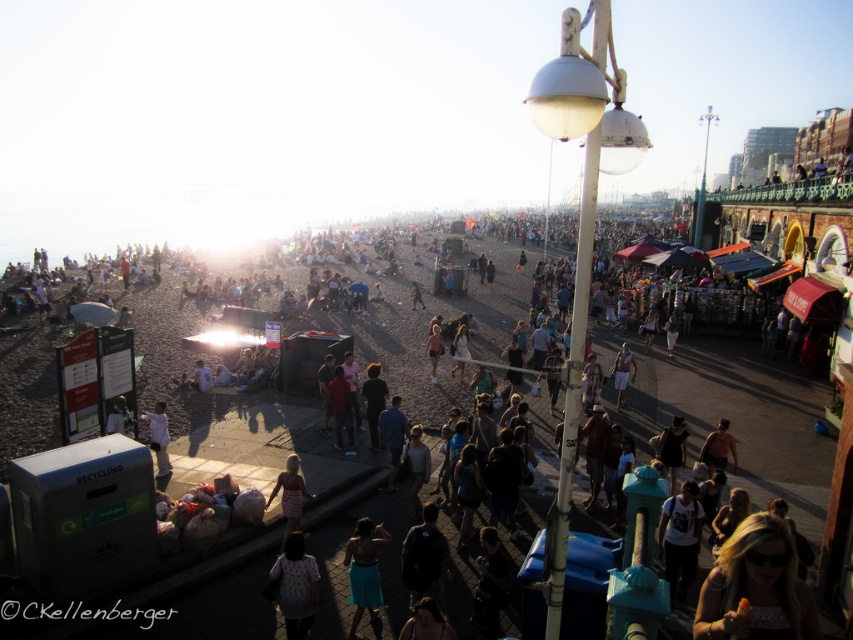
Is white dotted sweater at lower center wider than white cotton shirt at lower left?

Yes, white dotted sweater at lower center is wider than white cotton shirt at lower left.

Which is in front, point (317, 577) or point (161, 451)?

Point (317, 577) is in front.

Which is behind, point (312, 616) or point (157, 470)?

The point (157, 470) is behind.

At what (x,y) coordinates should I click in order to perform the action: click on white dotted sweater at lower center. Please return your answer as a coordinate pair (x, y). Looking at the image, I should click on (296, 586).

Looking at this image, can you confirm if blonde hair at lower right is positioned to the right of blue fabric shirt at center?

Yes, blonde hair at lower right is to the right of blue fabric shirt at center.

Can you confirm if blonde hair at lower right is positioned above blue fabric shirt at center?

Actually, blonde hair at lower right is below blue fabric shirt at center.

Between point (747, 538) and point (387, 484), which one is positioned behind?

The point (387, 484) is behind.

Where is `blonde hair at lower right`? blonde hair at lower right is located at coordinates (756, 586).

Which is more to the right, blonde hair at lower right or white cotton shorts at center?

Positioned to the right is white cotton shorts at center.

Locate an element on the screen. This screenshot has width=853, height=640. blonde hair at lower right is located at coordinates (756, 586).